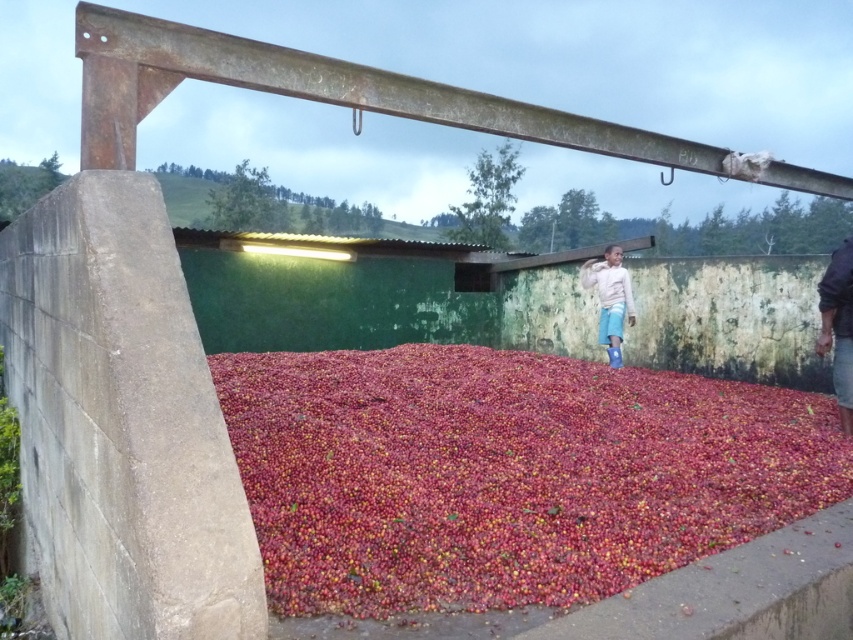
Between smooth red berries at center and light beige sweater at upper right, which one appears on the left side from the viewer's perspective?

light beige sweater at upper right is more to the left.

Locate an element on the screen. The width and height of the screenshot is (853, 640). smooth red berries at center is located at coordinates (506, 474).

Can you confirm if rusty metal beam at upper center is taller than light beige sweater at upper right?

Incorrect, rusty metal beam at upper center's height is not larger of light beige sweater at upper right's.

Does point (125, 67) come farther from viewer compared to point (601, 273)?

No, (125, 67) is closer to viewer.

Locate an element on the screen. rusty metal beam at upper center is located at coordinates pos(314,92).

Can you confirm if smooth red berries at center is taller than dark blue fabric at right?

No.

Does smooth red berries at center have a lesser height compared to dark blue fabric at right?

Correct, smooth red berries at center is not as tall as dark blue fabric at right.

Image resolution: width=853 pixels, height=640 pixels. Find the location of `smooth red berries at center`. smooth red berries at center is located at coordinates (506, 474).

Where is `smooth red berries at center`? smooth red berries at center is located at coordinates (506, 474).